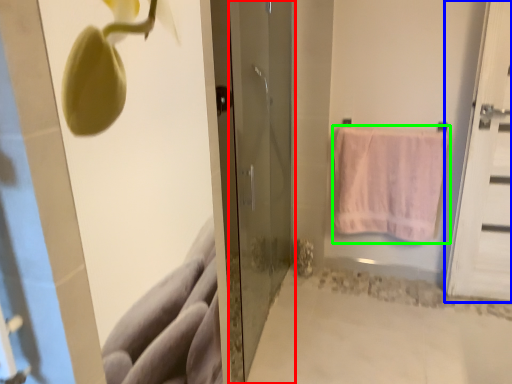
Question: Based on their relative distances, which object is farther from door (highlighted by a red box)? Choose from door (highlighted by a blue box) and towel (highlighted by a green box).

Choices:
 (A) door
 (B) towel

Answer: (A)